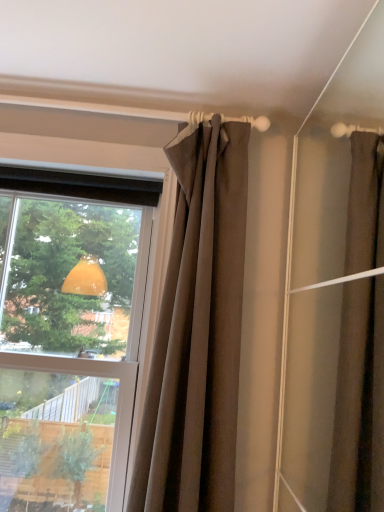
Question: In the image, is transparent glass window at upper left positioned in front of or behind brown fabric curtain at upper center?

Choices:
 (A) front
 (B) behind

Answer: (B)

Question: Is transparent glass window at upper left taller or shorter than brown fabric curtain at upper center?

Choices:
 (A) tall
 (B) short

Answer: (A)

Question: From the image's perspective, is transparent glass window at upper left above or below brown fabric curtain at upper center?

Choices:
 (A) above
 (B) below

Answer: (B)

Question: Is brown fabric curtain at upper center in front of or behind transparent glass window at upper left in the image?

Choices:
 (A) behind
 (B) front

Answer: (B)

Question: Is point (173, 360) positioned closer to the camera than point (61, 250)?

Choices:
 (A) closer
 (B) farther

Answer: (A)

Question: From a real-world perspective, is brown fabric curtain at upper center physically located above or below transparent glass window at upper left?

Choices:
 (A) above
 (B) below

Answer: (A)

Question: Is brown fabric curtain at upper center spatially inside transparent glass window at upper left, or outside of it?

Choices:
 (A) inside
 (B) outside

Answer: (B)